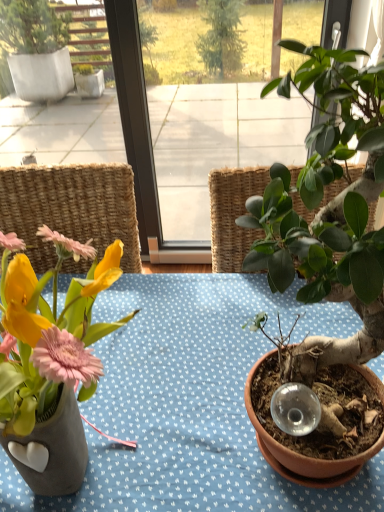
Question: Based on their positions, is matte ceramic vase at left located to the left or right of green matte plant at right?

Choices:
 (A) left
 (B) right

Answer: (A)

Question: From a real-world perspective, relative to green matte plant at right, is matte ceramic vase at left vertically above or below?

Choices:
 (A) above
 (B) below

Answer: (B)

Question: Considering their positions, is matte ceramic vase at left located in front of or behind green matte plant at right?

Choices:
 (A) behind
 (B) front

Answer: (A)

Question: Is green matte plant at right spatially inside matte ceramic vase at left, or outside of it?

Choices:
 (A) inside
 (B) outside

Answer: (B)

Question: Relative to matte ceramic vase at left, is green matte plant at right in front or behind?

Choices:
 (A) front
 (B) behind

Answer: (A)

Question: In the image, is green matte plant at right on the left side or the right side of matte ceramic vase at left?

Choices:
 (A) right
 (B) left

Answer: (A)

Question: From their relative heights in the image, would you say green matte plant at right is taller or shorter than matte ceramic vase at left?

Choices:
 (A) short
 (B) tall

Answer: (B)